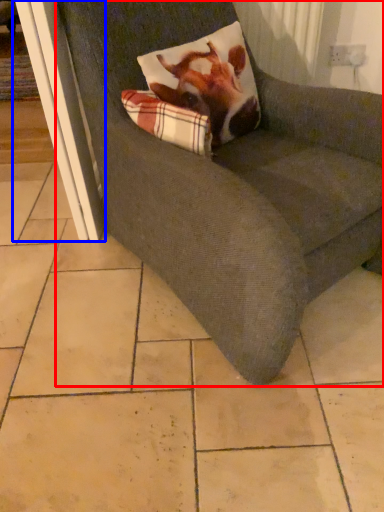
Question: Which point is further to the camera, chair (highlighted by a red box) or screen door (highlighted by a blue box)?

Choices:
 (A) chair
 (B) screen door

Answer: (B)